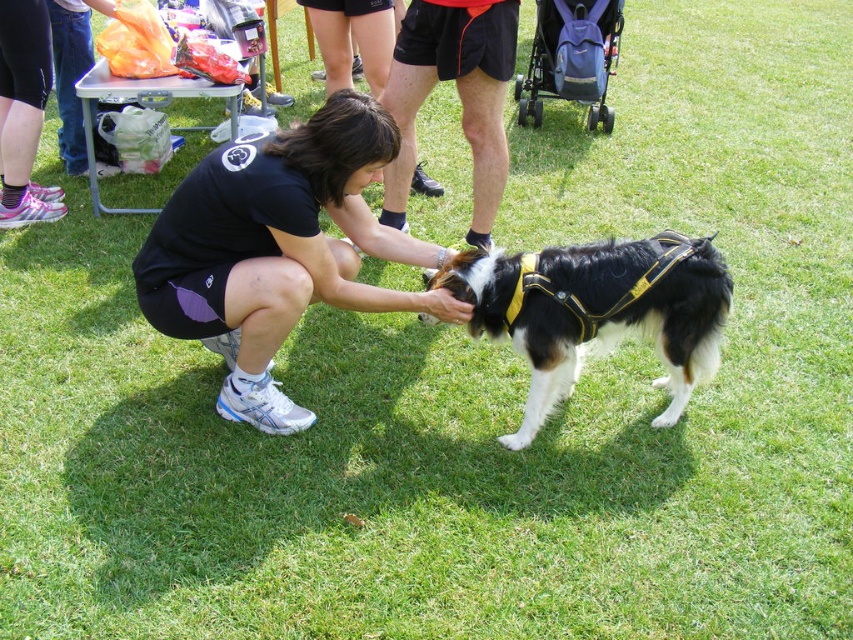
Question: In this image, where is black fabric squat at center located relative to black and white fur at center?

Choices:
 (A) left
 (B) right

Answer: (A)

Question: Considering the relative positions of black and white fur at center and black athletic shorts at center in the image provided, where is black and white fur at center located with respect to black athletic shorts at center?

Choices:
 (A) below
 (B) above

Answer: (A)

Question: Which point is closer to the camera?

Choices:
 (A) (408, 108)
 (B) (299, 195)
 (C) (489, 312)

Answer: (B)

Question: Based on their relative distances, which object is nearer to the black fabric squat at center?

Choices:
 (A) black athletic shorts at center
 (B) black and white fur at center

Answer: (B)

Question: Which of the following is the closest to the observer?

Choices:
 (A) (508, 51)
 (B) (683, 276)
 (C) (225, 333)

Answer: (B)

Question: Is black fabric squat at center bigger than black and white fur at center?

Choices:
 (A) yes
 (B) no

Answer: (A)